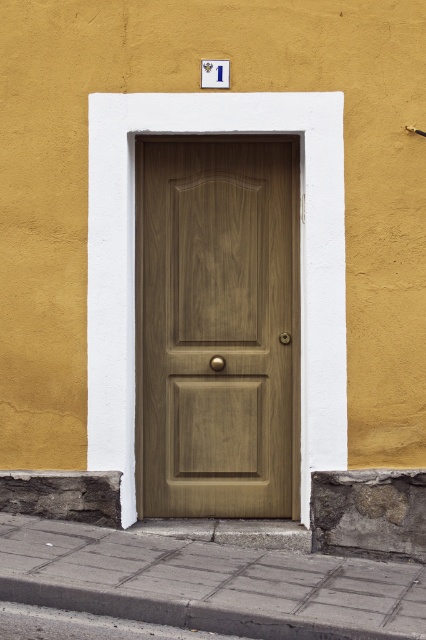
You are standing in front of the door and want to know if the wooden door at center can fit entirely on the gray concrete pavement at lower center. Based on their sizes, can it?

The wooden door at center occupies less space than gray concrete pavement at lower center, so yes, the wooden door at center can fit entirely on the gray concrete pavement at lower center.